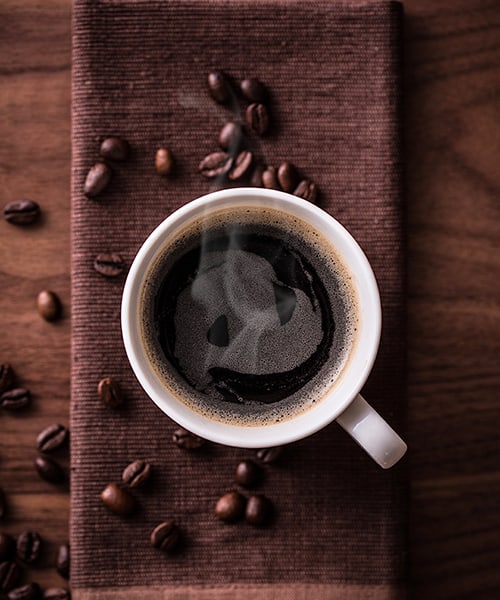
What are the coordinates of `brown kitchen towel` in the screenshot? It's located at (129, 425).